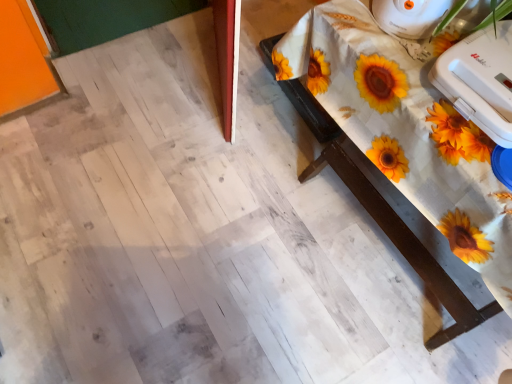
Question: Could you tell me if white wood table at upper right is facing white plastic toaster at upper right, arranged as the 1th appliance when ordered from the bottom?

Choices:
 (A) no
 (B) yes

Answer: (A)

Question: Is white plastic toaster at upper right, which is the second appliance from top to bottom, at the back of white wood table at upper right?

Choices:
 (A) yes
 (B) no

Answer: (B)

Question: From a real-world perspective, is white wood table at upper right over white plastic toaster at upper right, arranged as the 1th appliance when ordered from the bottom?

Choices:
 (A) yes
 (B) no

Answer: (B)

Question: Is white wood table at upper right in contact with white plastic toaster at upper right, arranged as the 1th appliance when ordered from the bottom?

Choices:
 (A) no
 (B) yes

Answer: (A)

Question: Is white wood table at upper right not close to white plastic toaster at upper right, which is the second appliance from top to bottom?

Choices:
 (A) no
 (B) yes

Answer: (A)

Question: Is white plastic iron at upper right, the 1th appliance positioned from the top, in front of or behind white plastic toaster at upper right, which is the second appliance from top to bottom, in the image?

Choices:
 (A) front
 (B) behind

Answer: (B)

Question: From a real-world perspective, is white plastic iron at upper right, positioned as the second appliance in bottom-to-top order, above or below white plastic toaster at upper right, which is the second appliance from top to bottom?

Choices:
 (A) above
 (B) below

Answer: (A)

Question: In terms of width, does white plastic iron at upper right, the 1th appliance positioned from the top, look wider or thinner when compared to white plastic toaster at upper right, arranged as the 1th appliance when ordered from the bottom?

Choices:
 (A) thin
 (B) wide

Answer: (A)

Question: Is white plastic iron at upper right, positioned as the second appliance in bottom-to-top order, inside the boundaries of white plastic toaster at upper right, which is the second appliance from top to bottom, or outside?

Choices:
 (A) outside
 (B) inside

Answer: (A)

Question: Is white wood table at upper right inside the boundaries of white plastic iron at upper right, the 1th appliance positioned from the top, or outside?

Choices:
 (A) outside
 (B) inside

Answer: (A)

Question: Is white wood table at upper right taller or shorter than white plastic iron at upper right, the 1th appliance positioned from the top?

Choices:
 (A) tall
 (B) short

Answer: (A)

Question: Based on their sizes in the image, would you say white wood table at upper right is bigger or smaller than white plastic iron at upper right, the 1th appliance positioned from the top?

Choices:
 (A) small
 (B) big

Answer: (B)

Question: From a real-world perspective, is white wood table at upper right positioned above or below white plastic iron at upper right, positioned as the second appliance in bottom-to-top order?

Choices:
 (A) below
 (B) above

Answer: (A)

Question: Looking at the image, does white plastic iron at upper right, the 1th appliance positioned from the top, seem bigger or smaller compared to white wood table at upper right?

Choices:
 (A) small
 (B) big

Answer: (A)

Question: Is white plastic iron at upper right, the 1th appliance positioned from the top, inside or outside of white wood table at upper right?

Choices:
 (A) outside
 (B) inside

Answer: (A)